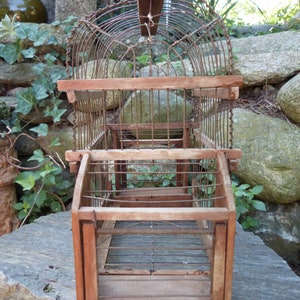
Locate an element on the screen. brown framing is located at coordinates (86, 253).